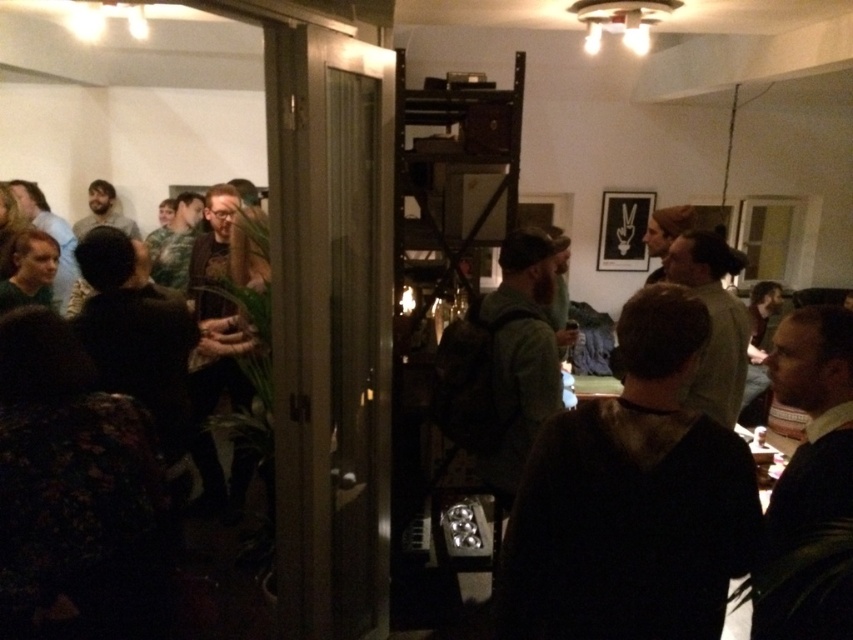
Which is behind, point (587, 484) or point (96, 353)?

Point (96, 353)

Can you confirm if dark brown hoodie at center is thinner than dark brown leather jacket at left?

No, dark brown hoodie at center is not thinner than dark brown leather jacket at left.

Does point (677, 634) lie in front of point (115, 371)?

Yes, point (677, 634) is closer to viewer.

I want to click on dark brown hoodie at center, so click(631, 499).